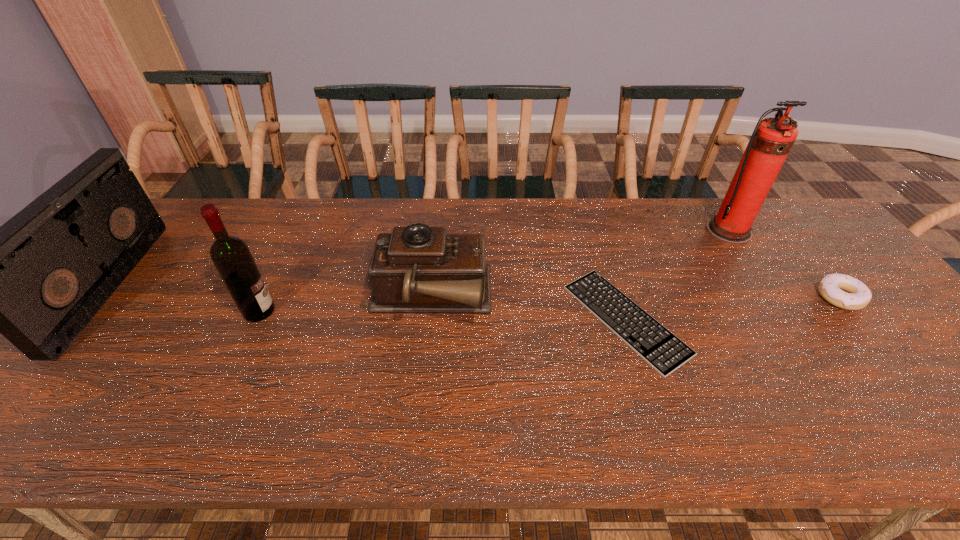
Locate an element on the screen. The image size is (960, 540). free point that satisfies the following two spatial constraints: 1. on the front side of the videotape; 2. on the right side of the fourth object from left to right is located at coordinates (81, 320).

Locate an element on the screen. The height and width of the screenshot is (540, 960). vacant area that satisfies the following two spatial constraints: 1. at the discharge end of the tallest object; 2. on the front side of the videotape is located at coordinates (764, 285).

This screenshot has height=540, width=960. I want to click on vacant region that satisfies the following two spatial constraints: 1. on the horn of the third shortest object; 2. on the left side of the third object from right to left, so click(424, 320).

Where is `free space that satisfies the following two spatial constraints: 1. on the front and back of the computer keyboard; 2. on the right side of the second object from left to right`? free space that satisfies the following two spatial constraints: 1. on the front and back of the computer keyboard; 2. on the right side of the second object from left to right is located at coordinates (255, 320).

The height and width of the screenshot is (540, 960). I want to click on vacant space that satisfies the following two spatial constraints: 1. on the horn of the computer keyboard; 2. on the left side of the phonograph_record, so click(424, 320).

Identify the location of free space that satisfies the following two spatial constraints: 1. at the discharge end of the tallest object; 2. on the front side of the videotape. (764, 285).